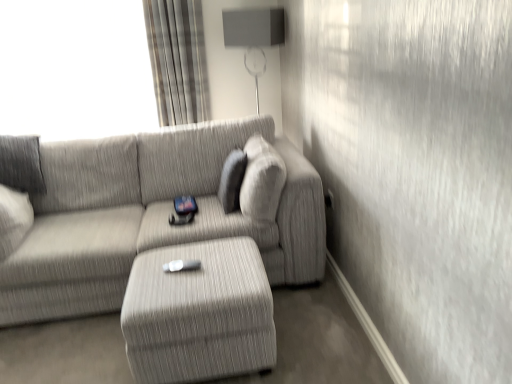
Identify the location of vacant area located to the right-hand side of white matte wii controller at center. The image size is (512, 384). (224, 259).